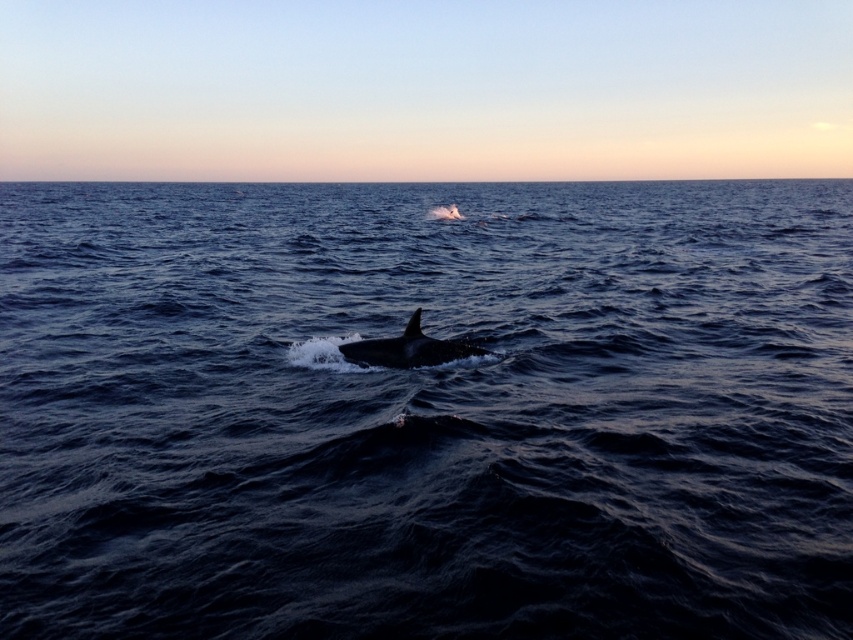
Question: Does dark blue water at center lie in front of smooth gray whale at center?

Choices:
 (A) yes
 (B) no

Answer: (A)

Question: Is dark blue water at center above smooth gray whale at center?

Choices:
 (A) no
 (B) yes

Answer: (B)

Question: Which object is farther from the camera taking this photo?

Choices:
 (A) smooth gray whale at center
 (B) dark blue water at center

Answer: (A)

Question: Where is dark blue water at center located in relation to smooth gray whale at center in the image?

Choices:
 (A) right
 (B) left

Answer: (B)